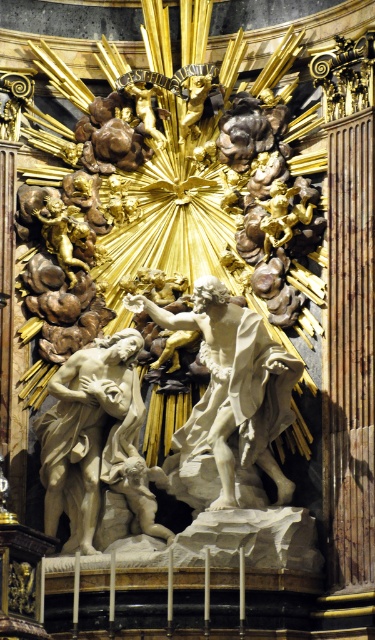
You are an art conservator examining the Baroque sculptural group. You need to clean the white marble statue at center and the gold polished statue at upper center. Which statue should you clean first if you want to start with the one that is closer to the viewer?

The white marble statue at center should be cleaned first because it is in front of the gold polished statue at upper center, making it closer to the viewer.